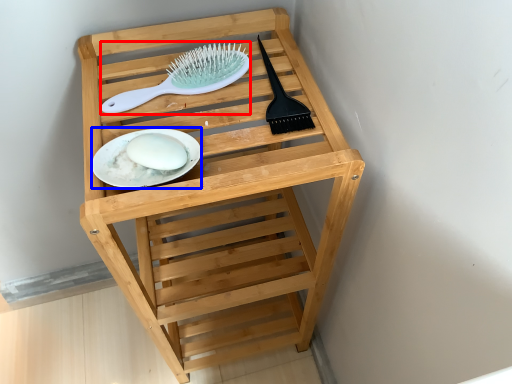
Question: Which of the following is the closest to the observer, brush (highlighted by a red box) or plate (highlighted by a blue box)?

Choices:
 (A) brush
 (B) plate

Answer: (B)